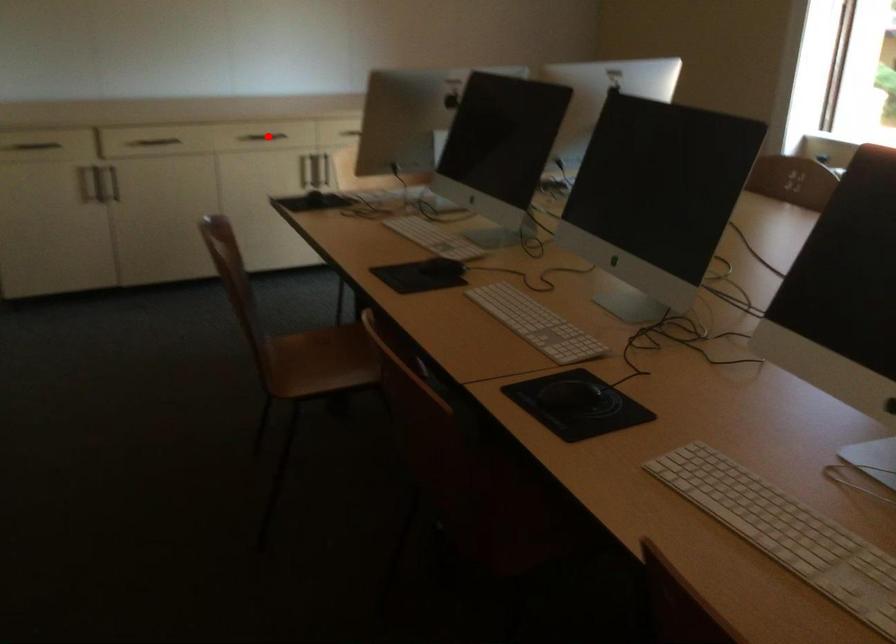
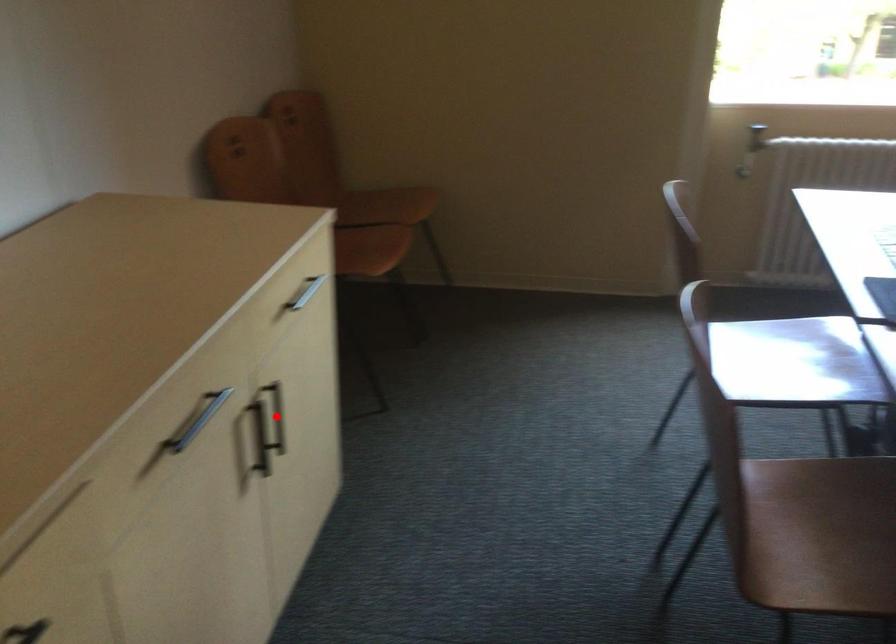
I am providing you with two images of the same scene from different viewpoints. A red point is marked on the first image and another point is marked on the second image. Do the highlighted points in image1 and image2 indicate the same real-world spot?

No